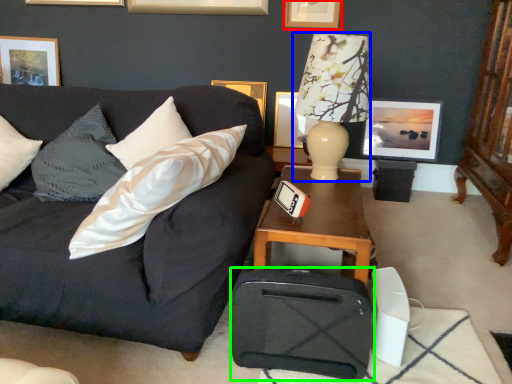
Question: Estimate the real-world distances between objects in this image. Which object is closer to picture frame (highlighted by a red box), table lamp (highlighted by a blue box) or luggage (highlighted by a green box)?

Choices:
 (A) table lamp
 (B) luggage

Answer: (A)